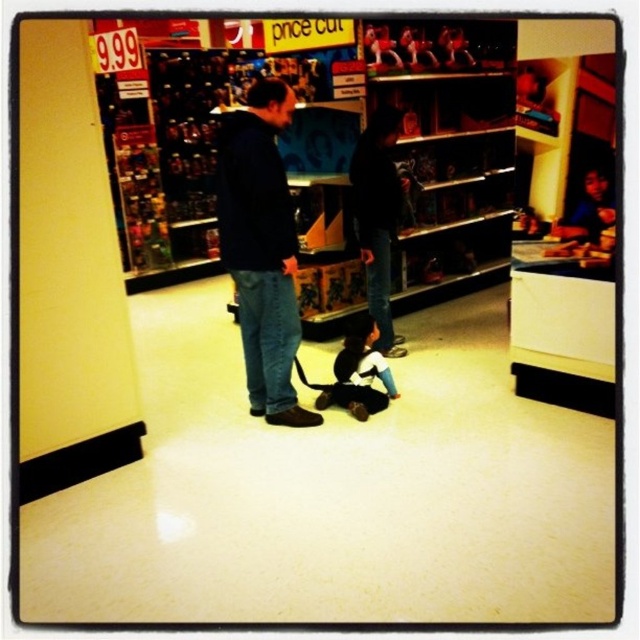
Question: Which object appears closest to the camera in this image?

Choices:
 (A) dark blue hoodie at center
 (B) soft plush bear at center
 (C) matte pink plush at upper center

Answer: (A)

Question: Is dark blue hoodie at center below soft plush bear at center?

Choices:
 (A) no
 (B) yes

Answer: (A)

Question: Is dark blue hoodie at center above soft plush bear at center?

Choices:
 (A) yes
 (B) no

Answer: (A)

Question: In this image, where is soft plush bear at center located relative to matte pink plush at upper center?

Choices:
 (A) below
 (B) above

Answer: (A)

Question: Which object appears farthest from the camera in this image?

Choices:
 (A) soft plush bear at center
 (B) metallic silver toy at upper center
 (C) dark blue hoodie at center

Answer: (B)

Question: Which of these objects is positioned closest to the dark blue hoodie at center?

Choices:
 (A) metallic silver toy at upper center
 (B) matte pink plush at upper center
 (C) soft plush bear at center

Answer: (C)